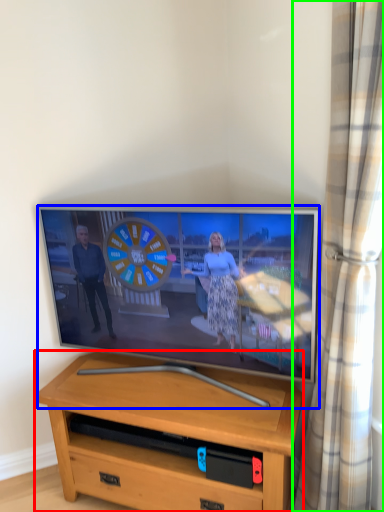
Question: Based on their relative distances, which object is farther from desk (highlighted by a red box)? Choose from television (highlighted by a blue box) and curtain (highlighted by a green box).

Choices:
 (A) television
 (B) curtain

Answer: (B)